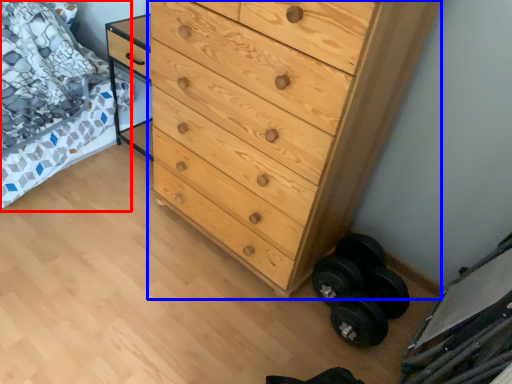
Question: Among these objects, which one is farthest to the camera, bed (highlighted by a red box) or chest of drawers (highlighted by a blue box)?

Choices:
 (A) bed
 (B) chest of drawers

Answer: (A)